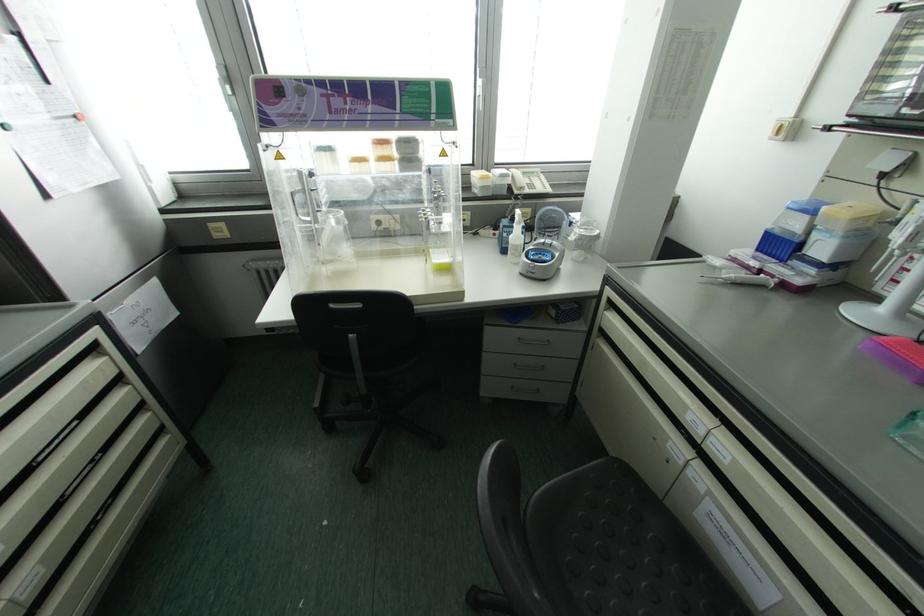
Where would you lift the telephone handset? Please return your answer as a coordinate pair (x, y).

(529, 183)